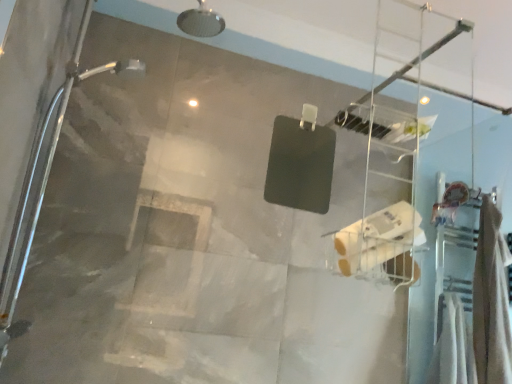
Question: From the image's perspective, is beige fabric towel at right over clear plastic ladder at upper center?

Choices:
 (A) no
 (B) yes

Answer: (A)

Question: Is beige fabric towel at right at the left side of clear plastic ladder at upper center?

Choices:
 (A) no
 (B) yes

Answer: (A)

Question: Considering the relative sizes of beige fabric towel at right and clear plastic ladder at upper center in the image provided, is beige fabric towel at right taller than clear plastic ladder at upper center?

Choices:
 (A) no
 (B) yes

Answer: (B)

Question: Can you confirm if beige fabric towel at right is thinner than clear plastic ladder at upper center?

Choices:
 (A) yes
 (B) no

Answer: (B)

Question: From a real-world perspective, is beige fabric towel at right located beneath clear plastic ladder at upper center?

Choices:
 (A) yes
 (B) no

Answer: (A)

Question: Is beige fabric towel at right oriented away from clear plastic ladder at upper center?

Choices:
 (A) yes
 (B) no

Answer: (B)

Question: Does beige fabric towel at right have a lesser height compared to white matte toilet paper at center?

Choices:
 (A) no
 (B) yes

Answer: (A)

Question: Can you confirm if beige fabric towel at right is positioned to the left of white matte toilet paper at center?

Choices:
 (A) yes
 (B) no

Answer: (B)

Question: From a real-world perspective, is beige fabric towel at right located beneath white matte toilet paper at center?

Choices:
 (A) yes
 (B) no

Answer: (B)

Question: Is beige fabric towel at right smaller than white matte toilet paper at center?

Choices:
 (A) yes
 (B) no

Answer: (B)

Question: From the image's perspective, would you say beige fabric towel at right is shown under white matte toilet paper at center?

Choices:
 (A) no
 (B) yes

Answer: (B)

Question: Does beige fabric towel at right turn towards white matte toilet paper at center?

Choices:
 (A) no
 (B) yes

Answer: (A)

Question: Considering the relative sizes of white matte toilet paper at center and beige fabric towel at right in the image provided, is white matte toilet paper at center bigger than beige fabric towel at right?

Choices:
 (A) no
 (B) yes

Answer: (A)